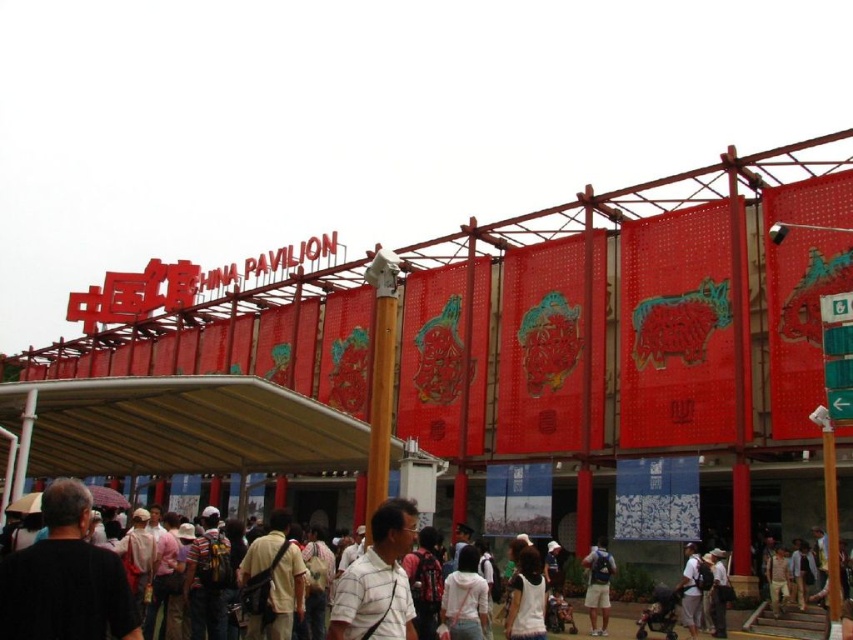
Which is more to the left, plaid shirt at center or matte black backpack at lower right?

plaid shirt at center

Describe the element at coordinates (376, 580) in the screenshot. Image resolution: width=853 pixels, height=640 pixels. I see `plaid shirt at center` at that location.

Where is `plaid shirt at center`? The image size is (853, 640). plaid shirt at center is located at coordinates (376, 580).